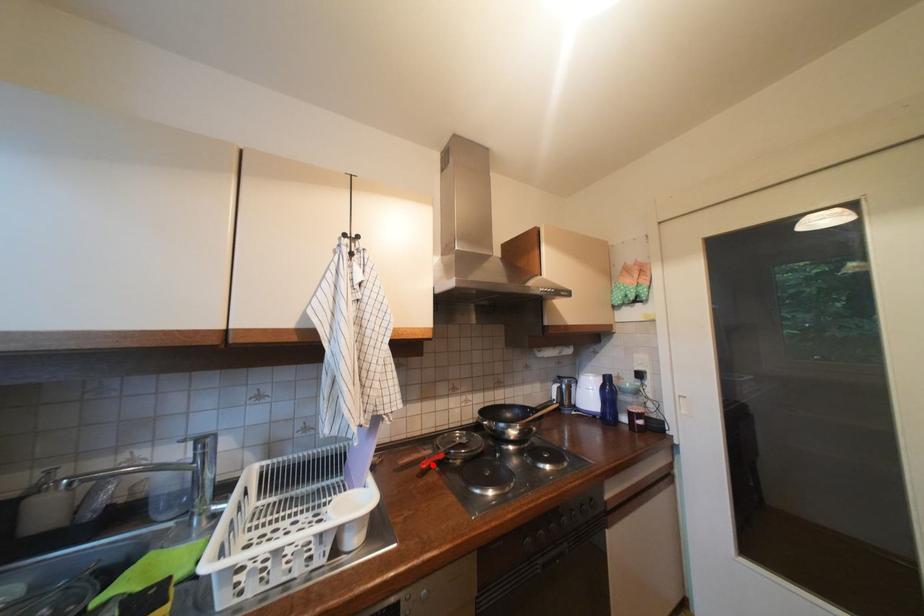
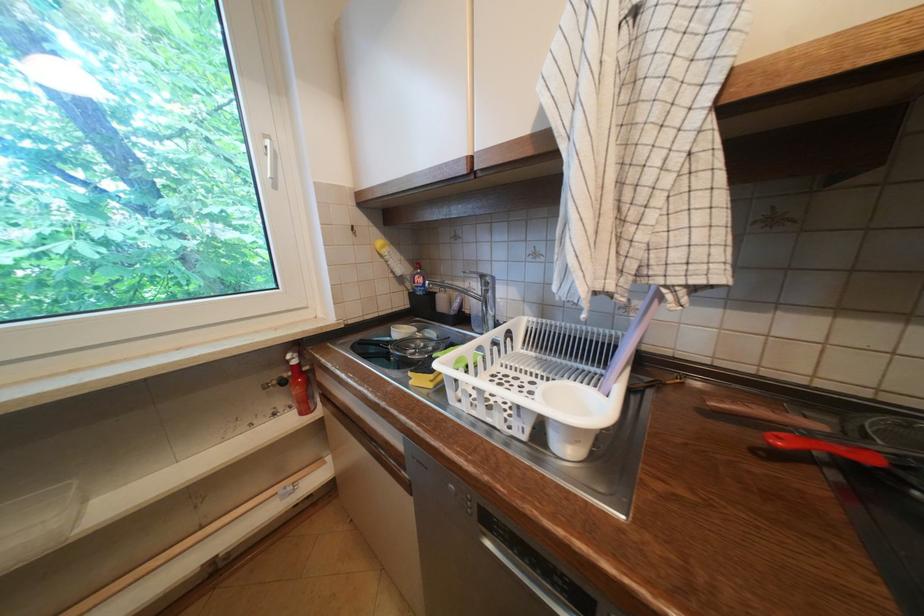
Find the pixel in the second image that matches the highlighted location in the first image.

(788, 440)